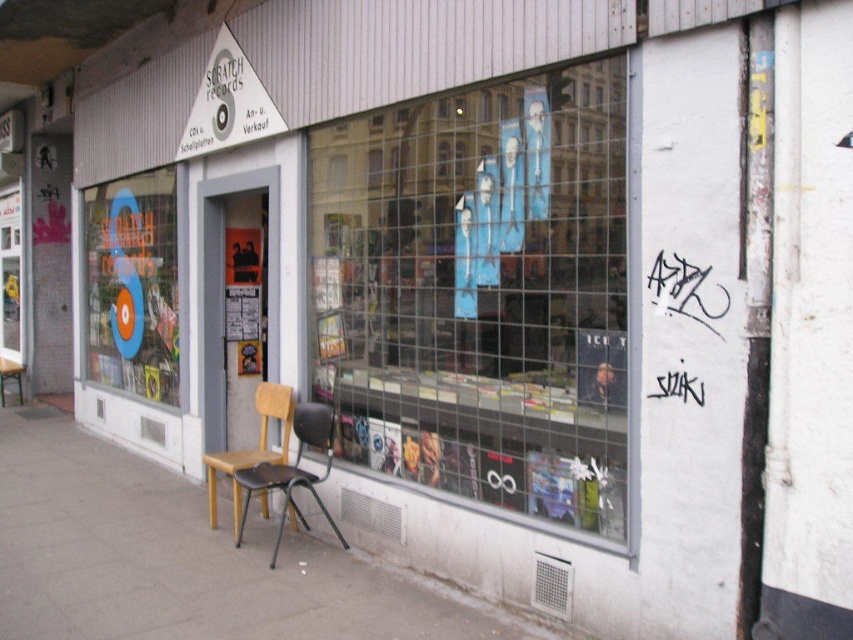
You are a delivery person who needs to park a 2.5 meter wide delivery truck next to the gray concrete pavement at lower left and the wooden seat at center. Based on their widths, which object should you park next to to ensure the truck fits?

The gray concrete pavement at lower left is wider than the wooden seat at center, so you should park the delivery truck next to the gray concrete pavement at lower left to ensure it fits.

You are standing outside the record shop and want to sit on either the black plastic chair at center or the wooden seat at center. Which one is more accessible to you?

The black plastic chair at center is closer to the viewer than the wooden seat at center, so it is more accessible.

You are standing in front of Scratch Records and want to reach a point that is exactly 18.13 feet away from you. Can you confirm if the point at coordinates point (x=323, y=468) is at that distance?

The point (x=323, y=468) is 18.13 feet away from the viewer, so yes, the point at coordinates point (x=323, y=468) is exactly at that distance.